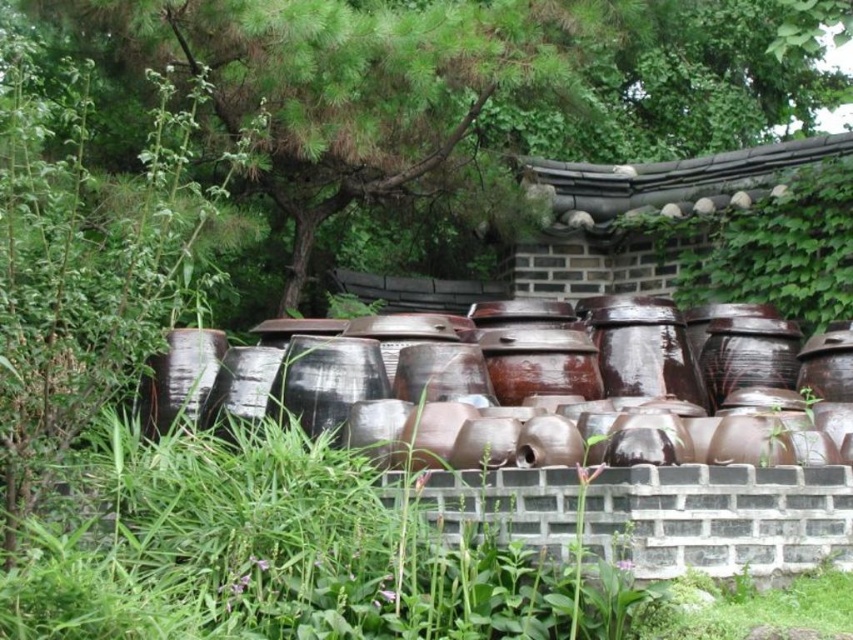
Question: Can you confirm if green leafy tree at upper center is thinner than brown glazed pottery at center?

Choices:
 (A) no
 (B) yes

Answer: (A)

Question: Is green leafy tree at upper center wider than brown glazed pottery at center?

Choices:
 (A) yes
 (B) no

Answer: (A)

Question: Is green leafy tree at upper center to the left of brown glazed pottery at center from the viewer's perspective?

Choices:
 (A) yes
 (B) no

Answer: (B)